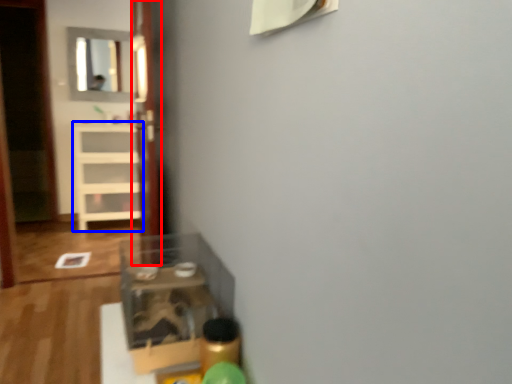
Question: Among these objects, which one is nearest to the camera, glass door (highlighted by a red box) or shelf (highlighted by a blue box)?

Choices:
 (A) glass door
 (B) shelf

Answer: (A)